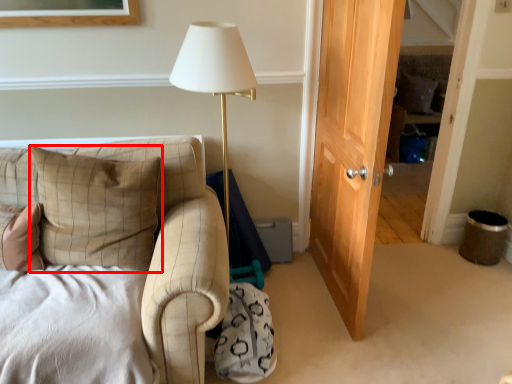
Question: Considering the relative positions of pillow (annotated by the red box) and pillow in the image provided, where is pillow (annotated by the red box) located with respect to the staircase?

Choices:
 (A) right
 (B) left

Answer: (B)